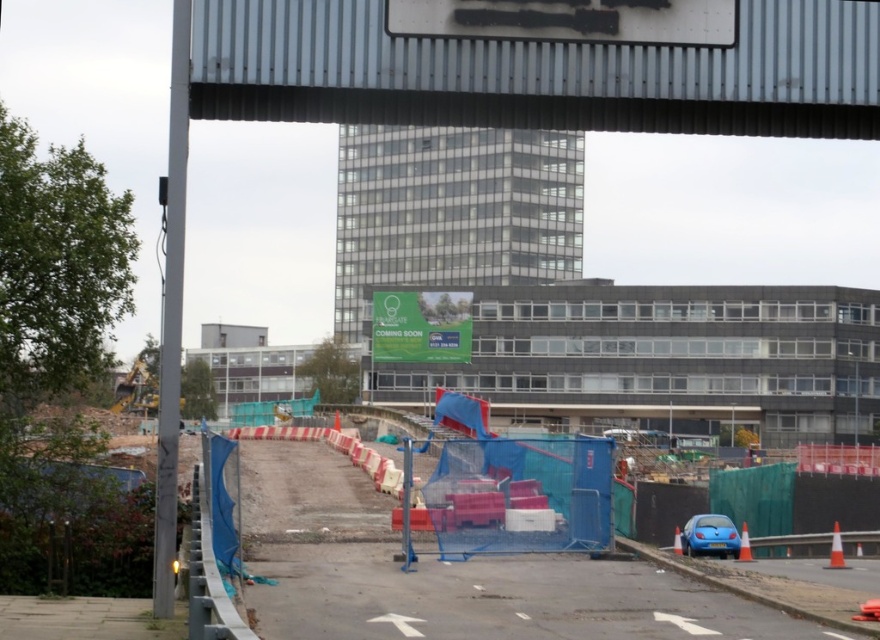
Can you confirm if white plastic cone at lower right is taller than orange traffic cone at lower right?

Yes.

Does white plastic cone at lower right have a lesser width compared to orange traffic cone at lower right?

Incorrect, white plastic cone at lower right's width is not less than orange traffic cone at lower right's.

Is point (831, 561) behind point (675, 554)?

Yes, it is.

Identify the location of white plastic cone at lower right. (836, 548).

Consider the image. Is white plastic cone at lower right to the right of orange plastic cone at center from the viewer's perspective?

Indeed, white plastic cone at lower right is positioned on the right side of orange plastic cone at center.

Does white plastic cone at lower right have a greater height compared to orange plastic cone at center?

Yes, white plastic cone at lower right is taller than orange plastic cone at center.

You are a GUI agent. You are given a task and a screenshot of the screen. Output one action in this format:
    pyautogui.click(x=<x>, y=<y>)
    Task: Click on the white plastic cone at lower right
    
    Given the screenshot: What is the action you would take?
    pyautogui.click(x=836, y=548)

Who is higher up, orange traffic cone at lower right or orange plastic cone at center?

Positioned higher is orange traffic cone at lower right.

Does orange traffic cone at lower right have a smaller size compared to orange plastic cone at center?

No.

Is point (673, 540) positioned after point (335, 410)?

No, (673, 540) is closer to viewer.

Find the location of a particular element. orange traffic cone at lower right is located at coordinates (677, 541).